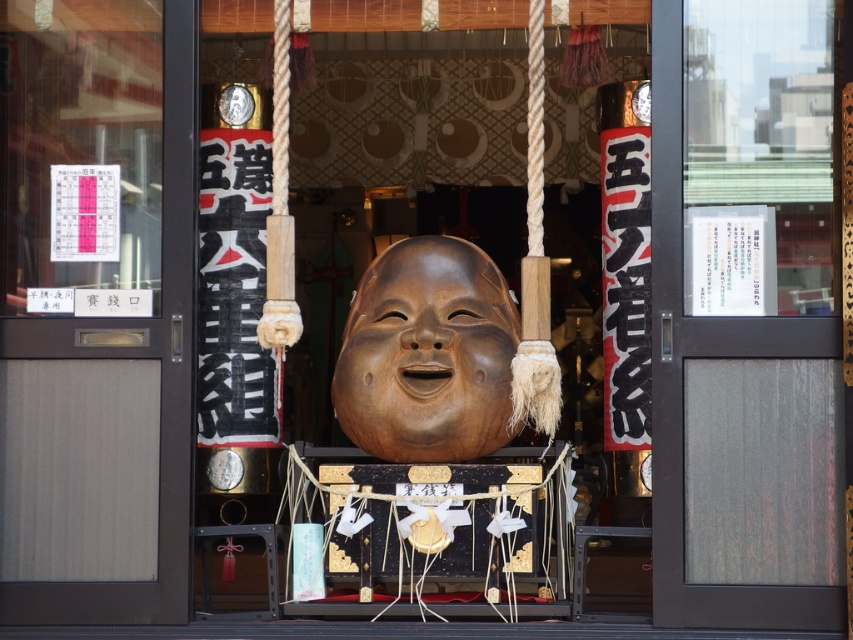
You are visiting a traditional Japanese shrine and notice the wooden mask at center and the transparent glass door at center. Which object is closer to you as you stand at the entrance?

The wooden mask at center is closer to you than the transparent glass door at center because it is positioned under it.

You are standing at the entrance of the shrine and want to take a photo of the wooden mask at the center of the altar. The camera you are using has a focal length of 50mm and a sensor size of 24mm x 36mm. If the point corresponding to the mask is at point coordinates point(354, 476), and the distance from this point to the camera is 30.51 meters, what is the approximate size of the mask in millimeters on the camera sensor?

The mask is located at point(354, 476) and is 30.51 meters away from the camera. Using the formula for calculating image size on a sensor, the sensor size is 24mm x 36mm. The focal length is 50mm. The distance from the point to the camera is 30.51 meters. The approximate size can be calculated using the formula size_on_sensor equals focal_length multiplied by object_size divided by distance. However, since the object size isn not provided, we can estimate based on the sensor dimensions and the coordinates

You are a visitor at the shrine entrance. You see the wooden statue at center and the wooden mask at center. Which object is positioned higher?

The wooden mask at center is positioned higher than the wooden statue at center.